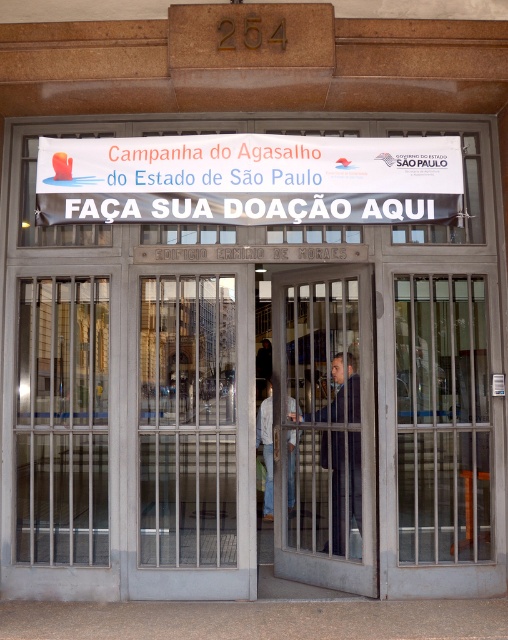
Does dark blue suit at center have a smaller size compared to denim pants at center?

Actually, dark blue suit at center might be larger than denim pants at center.

Between dark blue suit at center and denim pants at center, which one is positioned higher?

dark blue suit at center is higher up.

Identify the location of dark blue suit at center. (337, 490).

Locate an element on the screen. The height and width of the screenshot is (640, 508). dark blue suit at center is located at coordinates [337, 490].

Does metallic gray door at center appear on the right side of metallic glass door at center?

Incorrect, metallic gray door at center is not on the right side of metallic glass door at center.

The width and height of the screenshot is (508, 640). What are the coordinates of `metallic gray door at center` in the screenshot? It's located at (197, 436).

Between metallic glass door at center and dark blue suit at center, which one is positioned higher?

Positioned higher is metallic glass door at center.

Who is positioned more to the right, metallic glass door at center or dark blue suit at center?

Positioned to the right is dark blue suit at center.

Who is more distant from viewer, (311, 532) or (336, 488)?

The point (311, 532) is more distant.

Locate an element on the screen. This screenshot has height=640, width=508. metallic glass door at center is located at coordinates (324, 428).